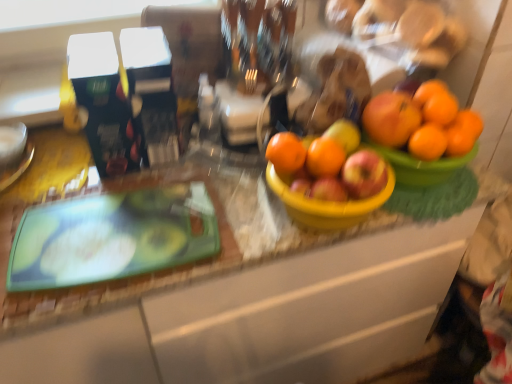
Question: Can you confirm if orange matte at right, acting as the fourth orange starting from the left, is positioned to the left of red matte apple at center?

Choices:
 (A) yes
 (B) no

Answer: (B)

Question: Is orange matte at right, which is the 1th orange in right-to-left order, facing towards red matte apple at center?

Choices:
 (A) no
 (B) yes

Answer: (A)

Question: Does orange matte at right, acting as the fourth orange starting from the left, lie in front of red matte apple at center?

Choices:
 (A) no
 (B) yes

Answer: (A)

Question: Is red matte apple at center completely or partially inside orange matte at right, which is the 1th orange in right-to-left order?

Choices:
 (A) no
 (B) yes

Answer: (A)

Question: From the image's perspective, is orange matte at right, which is the 1th orange in right-to-left order, on red matte apple at center?

Choices:
 (A) no
 (B) yes

Answer: (B)

Question: Is orange matte at center, positioned as the third orange in right-to-left order, inside or outside of orange matte at right, which is the 1th orange in right-to-left order?

Choices:
 (A) inside
 (B) outside

Answer: (B)

Question: From a real-world perspective, relative to orange matte at right, acting as the fourth orange starting from the left, is orange matte at center, positioned as the third orange in right-to-left order, vertically above or below?

Choices:
 (A) below
 (B) above

Answer: (A)

Question: In terms of size, does orange matte at center, which is counted as the 2th orange, starting from the left, appear bigger or smaller than orange matte at right, acting as the fourth orange starting from the left?

Choices:
 (A) big
 (B) small

Answer: (B)

Question: In the image, is orange matte at center, positioned as the third orange in right-to-left order, on the left side or the right side of orange matte at right, acting as the fourth orange starting from the left?

Choices:
 (A) left
 (B) right

Answer: (A)

Question: Based on their positions, is orange matte at center, which is counted as the 2th orange, starting from the left, located to the left or right of green glossy cutting board at left?

Choices:
 (A) right
 (B) left

Answer: (A)

Question: In terms of size, does orange matte at center, positioned as the third orange in right-to-left order, appear bigger or smaller than green glossy cutting board at left?

Choices:
 (A) big
 (B) small

Answer: (B)

Question: Is point (314, 140) closer or farther from the camera than point (119, 203)?

Choices:
 (A) farther
 (B) closer

Answer: (B)

Question: From the image's perspective, is orange matte at center, which is counted as the 2th orange, starting from the left, positioned above or below green glossy cutting board at left?

Choices:
 (A) above
 (B) below

Answer: (A)

Question: In terms of height, does red matte apple at center look taller or shorter compared to orange matte at center, positioned as the third orange in right-to-left order?

Choices:
 (A) tall
 (B) short

Answer: (B)

Question: From a real-world perspective, is red matte apple at center physically located above or below orange matte at center, positioned as the third orange in right-to-left order?

Choices:
 (A) above
 (B) below

Answer: (B)